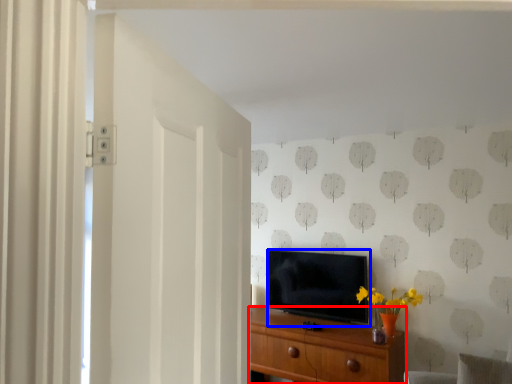
Question: Among these objects, which one is nearest to the camera, chest of drawers (highlighted by a red box) or television (highlighted by a blue box)?

Choices:
 (A) chest of drawers
 (B) television

Answer: (A)